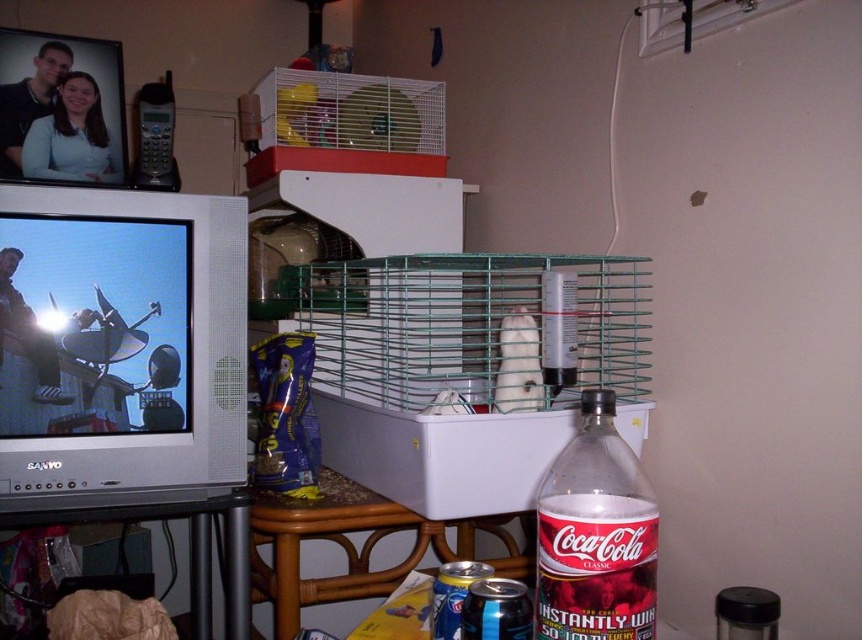
Question: Does rattan table at lower center have a larger size compared to wooden table at lower left?

Choices:
 (A) no
 (B) yes

Answer: (B)

Question: Which object is the closest to the translucent plastic coca-cola bottle at center?

Choices:
 (A) rattan table at lower center
 (B) wooden table at lower left

Answer: (A)

Question: Which is nearer to the translucent plastic coca-cola bottle at center?

Choices:
 (A) green wire birdcage at upper center
 (B) wooden table at lower left

Answer: (B)

Question: Estimate the real-world distances between objects in this image. Which object is farther from the translucent plastic coca-cola bottle at center?

Choices:
 (A) white matte hamster at center
 (B) rattan table at lower center
 (C) wooden table at lower left
 (D) green wire birdcage at upper center

Answer: (D)

Question: Can you confirm if wooden table at lower left is positioned below white matte hamster at center?

Choices:
 (A) no
 (B) yes

Answer: (B)

Question: Can you confirm if translucent plastic coca-cola bottle at center is positioned to the left of green wire birdcage at upper center?

Choices:
 (A) no
 (B) yes

Answer: (A)